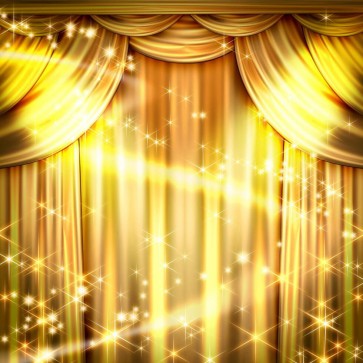
Identify the location of frame. The image size is (363, 363). (159, 7).